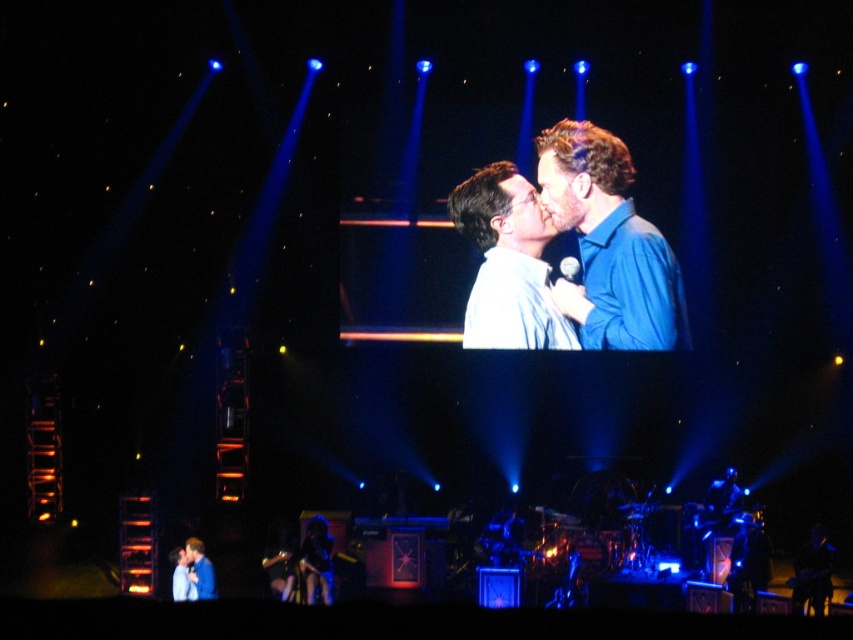
You are a photographer at the back of the venue. You want to take a photo that includes both the blue shirt at center and the white glossy shirt at center. Which shirt should you focus on first to ensure both are in frame?

You should focus on the blue shirt at center first because it is taller than the white glossy shirt at center, so it will be easier to frame both by starting with the larger one.

You are a photographer at the back of the venue trying to capture a clear photo of both the shiny black dress at lower center and the blue shirt at lower left. Which one will appear closer to you in the photo?

The shiny black dress at lower center will appear closer to you in the photo because it is further to the viewer than the blue shirt at lower left, meaning it is physically nearer to your position at the back.